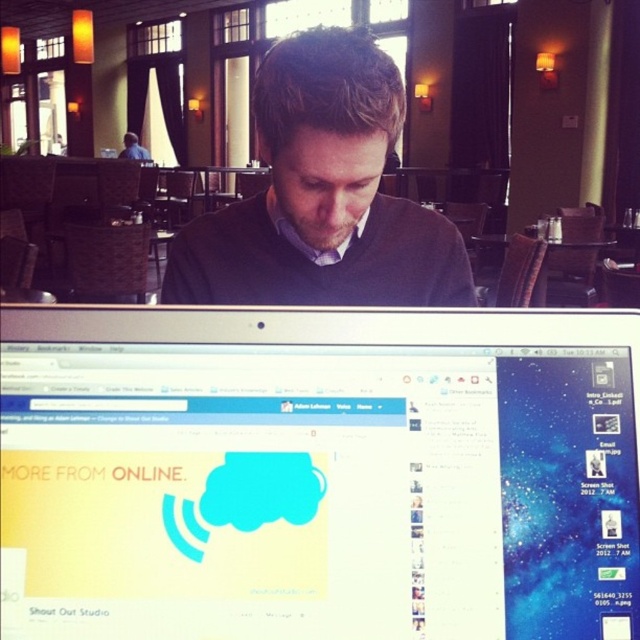
Looking at this image, you are a person who is 1.7 meters tall. You are sitting at the wooden table at center and wearing the matte black sweater at center. Can you comfortably rest your arms on the table without hunching over?

The wooden table at center has a greater height compared to matte black sweater at center. Since the table is taller than the sweater, it suggests the table is at a comfortable height for someone of your stature, allowing you to rest your arms without hunching over.

You are a customer in a coffee shop and want to check the laptop screen of the person at the table. Which object, the satin black monitor at center or the dark gray sweater at center, would you have to look down more to see?

The satin black monitor at center is shorter than the dark gray sweater at center, so you would have to look down more to see the dark gray sweater at center.